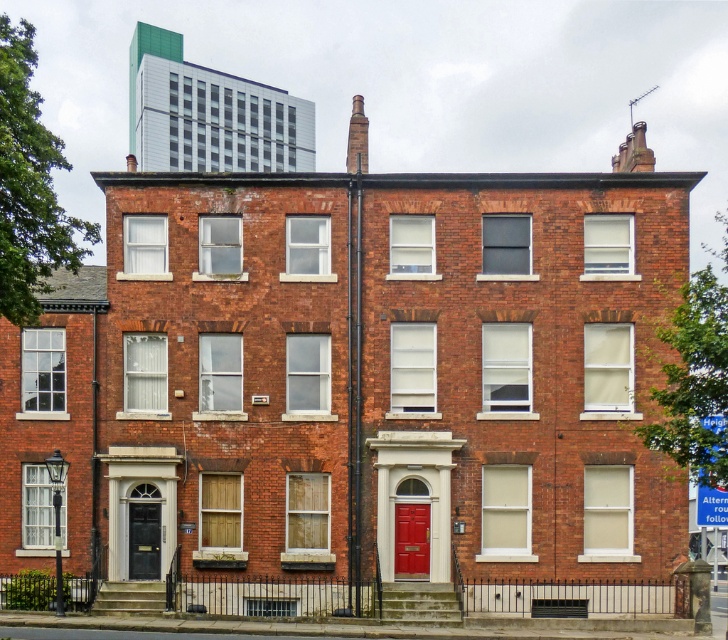
Between matte red door at center and matte black door at left, which one is positioned higher?

matte black door at left is higher up.

Can you confirm if matte red door at center is bigger than matte black door at left?

Actually, matte red door at center might be smaller than matte black door at left.

Between point (408, 518) and point (149, 570), which one is positioned behind?

Positioned behind is point (149, 570).

I want to click on matte red door at center, so click(x=411, y=540).